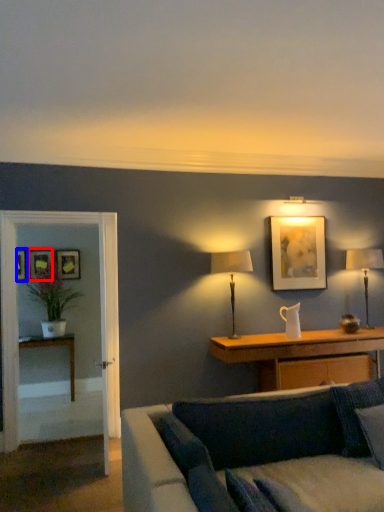
Question: Which of the following is the closest to the observer, picture frame (highlighted by a red box) or picture frame (highlighted by a blue box)?

Choices:
 (A) picture frame
 (B) picture frame

Answer: (B)